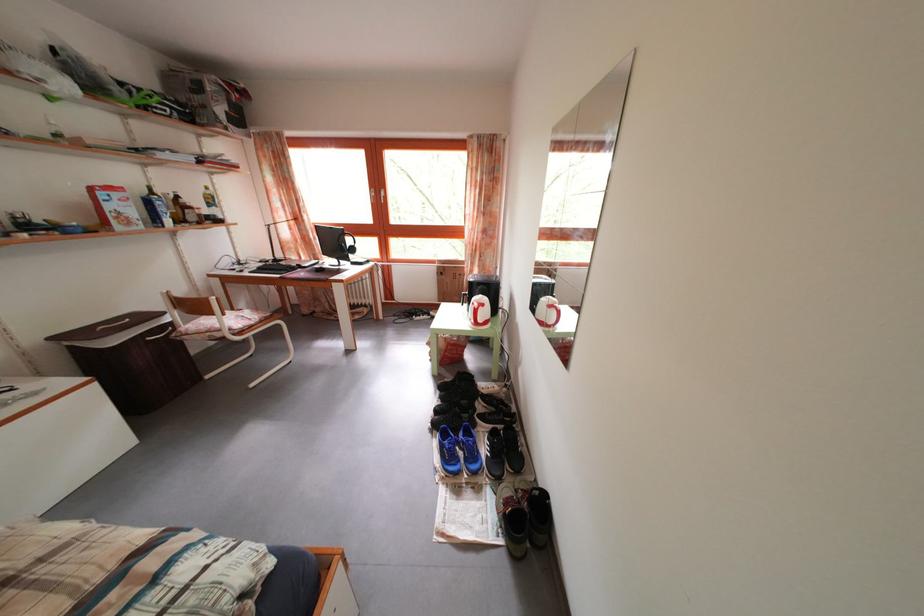
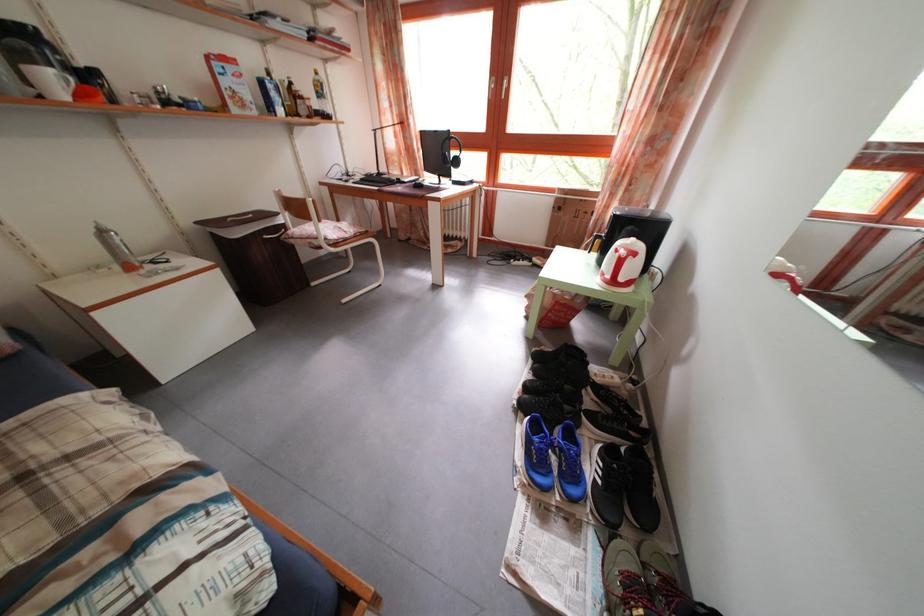
Find the pixel in the second image that matches point (476, 440) in the first image.

(578, 444)